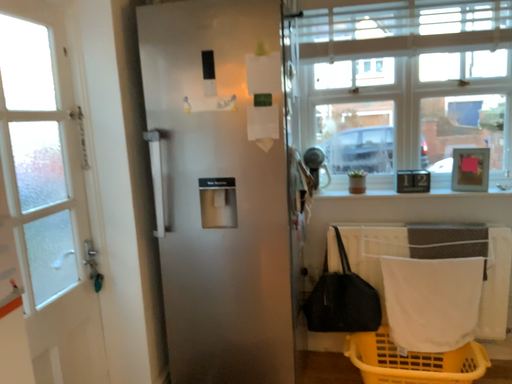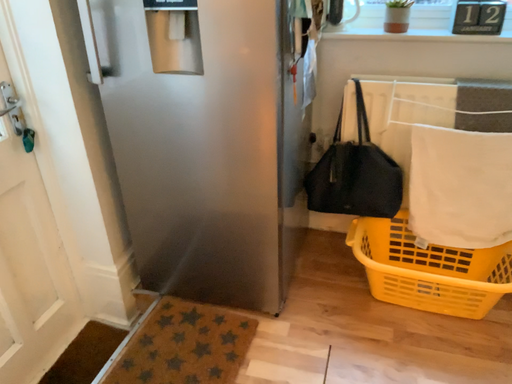
Question: Which way did the camera rotate in the video?

Choices:
 (A) rotated downward
 (B) rotated upward

Answer: (A)